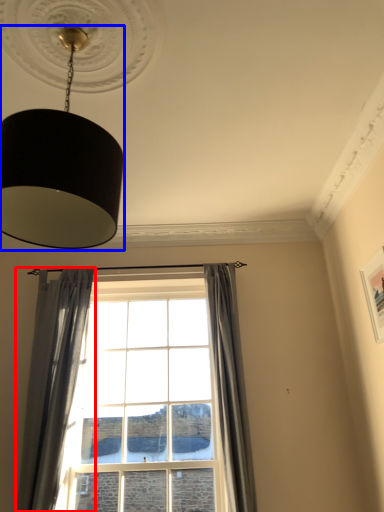
Question: Which object is further to the camera taking this photo, curtain (highlighted by a red box) or lamp (highlighted by a blue box)?

Choices:
 (A) curtain
 (B) lamp

Answer: (A)